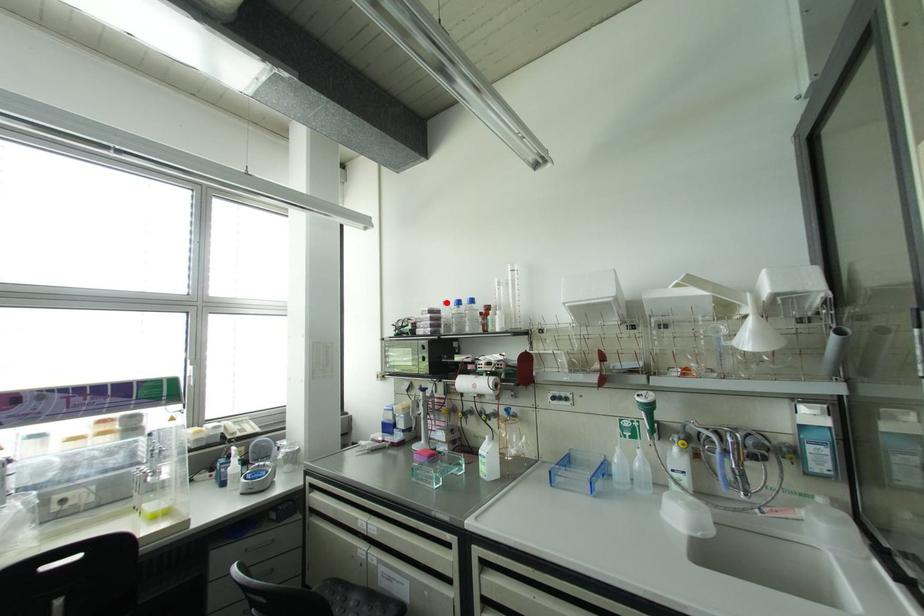
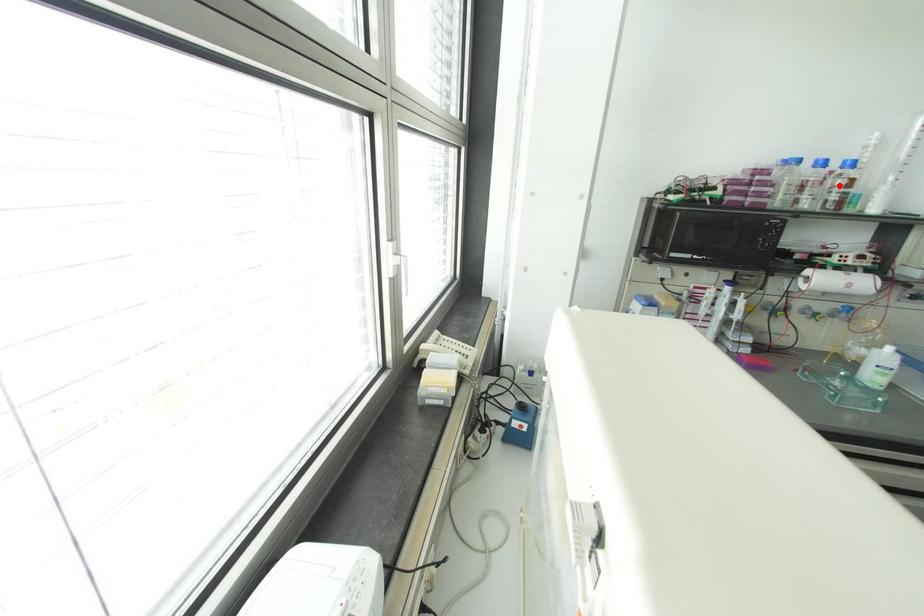
I am providing you with two images of the same scene from different viewpoints. A red point is marked on the first image and another point is marked on the second image. Is the marked point in image1 the same physical position as the marked point in image2?

No